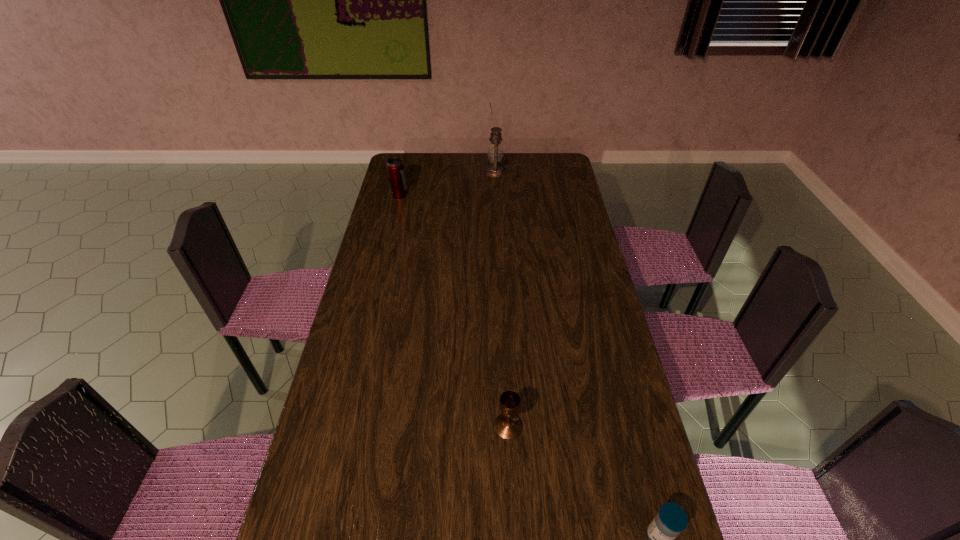
Locate an element on the screen. This screenshot has width=960, height=540. object located in the left edge section of the desktop is located at coordinates (395, 167).

The width and height of the screenshot is (960, 540). In the image, there is a desktop. In order to click on vacant space at the far edge in this screenshot , I will do `click(516, 163)`.

Locate an element on the screen. The width and height of the screenshot is (960, 540). vacant space at the left edge is located at coordinates (360, 313).

Locate an element on the screen. vacant space at the right edge of the desktop is located at coordinates (569, 239).

Locate an element on the screen. The width and height of the screenshot is (960, 540). vacant space that's between the farthest object and the second farthest object is located at coordinates (447, 184).

The image size is (960, 540). What are the coordinates of `free spot between the third farthest object and the oil lamp` in the screenshot? It's located at (501, 300).

Locate an element on the screen. Image resolution: width=960 pixels, height=540 pixels. free space that is in between the tallest object and the thermos bottle is located at coordinates (447, 184).

Image resolution: width=960 pixels, height=540 pixels. I want to click on vacant area between the oil lamp and the third nearest object, so click(447, 184).

The height and width of the screenshot is (540, 960). In order to click on empty location between the farthest object and the chalice in this screenshot , I will do 501,300.

Identify the location of vacant region between the chalice and the farthest object. This screenshot has height=540, width=960. (501, 300).